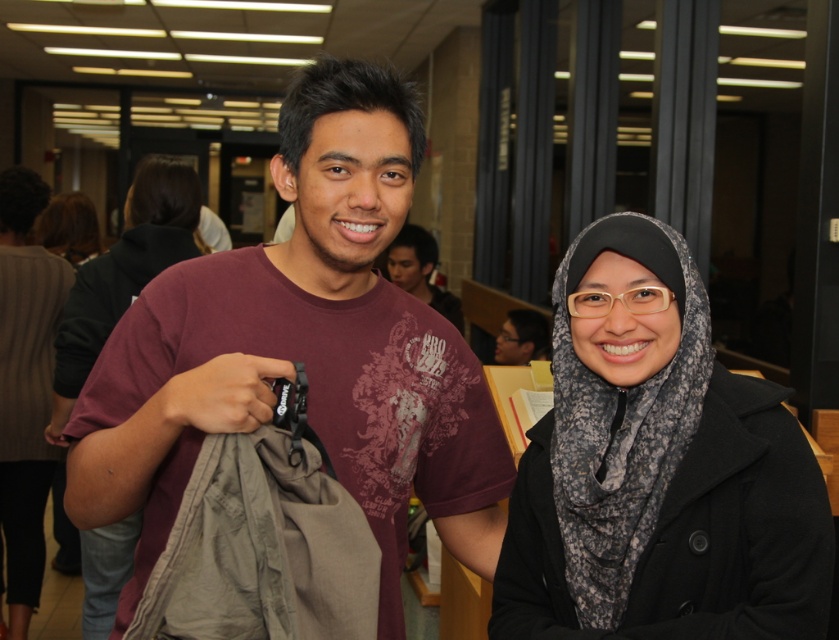
Question: Can you confirm if black textured hijab at center is wider than matte black hijab at center?

Choices:
 (A) no
 (B) yes

Answer: (A)

Question: Is maroon t-shirt at center smaller than black textured hijab at center?

Choices:
 (A) no
 (B) yes

Answer: (A)

Question: Is black textured hijab at center bigger than matte black hijab at center?

Choices:
 (A) yes
 (B) no

Answer: (B)

Question: Which point appears farthest from the camera in this image?

Choices:
 (A) (105, 310)
 (B) (744, 589)
 (C) (475, 417)
 (D) (451, 312)

Answer: (D)

Question: Which of these objects is positioned farthest from the matte black hijab at center?

Choices:
 (A) matte maroon t-shirt at center
 (B) maroon t-shirt at center

Answer: (A)

Question: Which object appears closest to the camera in this image?

Choices:
 (A) matte maroon t-shirt at center
 (B) matte black hijab at center

Answer: (B)